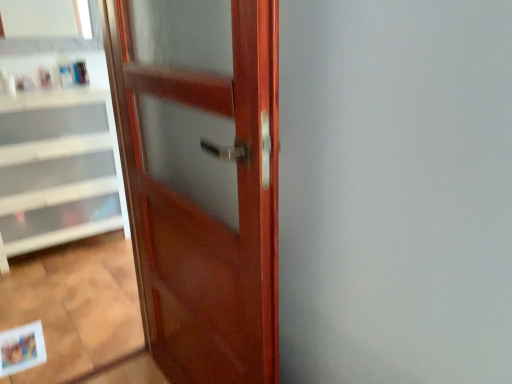
At what (x,y) coordinates should I click in order to perform the action: click on free space in front of translucent plastic bottle at upper left, the 2th toiletry in the right-to-left sequence. Please return your answer as a coordinate pair (x, y). Image resolution: width=512 pixels, height=384 pixels. Looking at the image, I should click on pos(65,89).